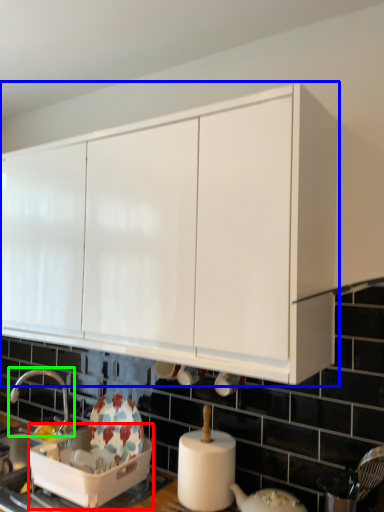
Question: Which object is positioned closest to appliance (highlighted by a red box)? Select from cabinetry (highlighted by a blue box) and tap (highlighted by a green box).

Choices:
 (A) cabinetry
 (B) tap

Answer: (B)